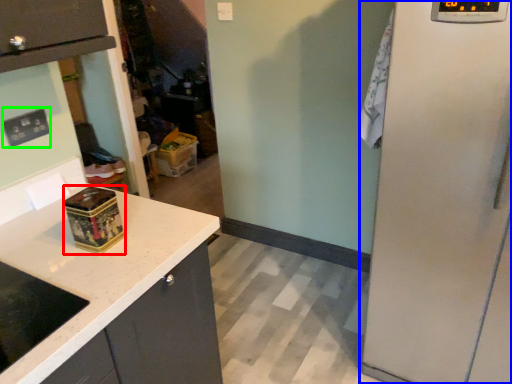
Question: Which is nearer to the appliance (highlighted by a red box)? appliance (highlighted by a blue box) or electric outlet (highlighted by a green box).

Choices:
 (A) appliance
 (B) electric outlet

Answer: (B)